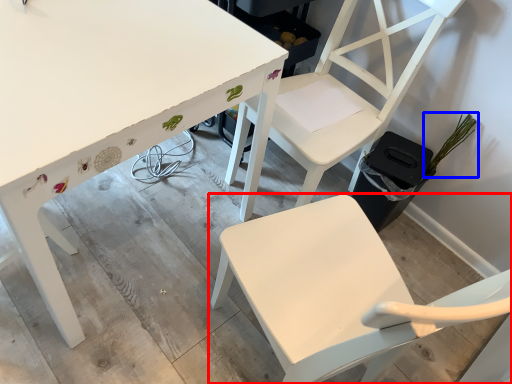
Question: Which of the following is the closest to the observer, chair (highlighted by a red box) or plant (highlighted by a blue box)?

Choices:
 (A) chair
 (B) plant

Answer: (A)